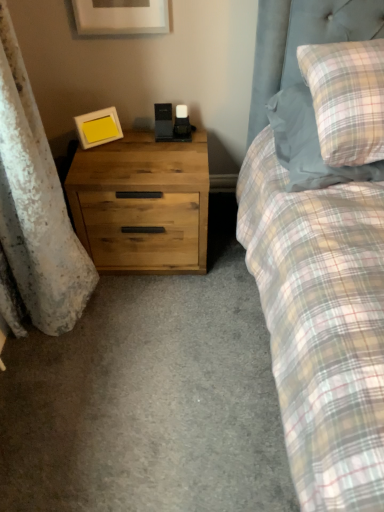
What is the approximate height of matte yellow picture frame at left, which is the 1th picture frame in bottom-to-top order?

It is 5.04 inches.

This screenshot has height=512, width=384. What do you see at coordinates (142, 202) in the screenshot?
I see `natural wood chest of drawers at left` at bounding box center [142, 202].

What do you see at coordinates (308, 144) in the screenshot? I see `plaid fabric pillow at upper right` at bounding box center [308, 144].

Find the location of `matte yellow picture frame at left, acting as the 2th picture frame starting from the front`. matte yellow picture frame at left, acting as the 2th picture frame starting from the front is located at coordinates pos(98,127).

From the image's perspective, which one is positioned higher, plaid fabric pillow at upper right or natural wood chest of drawers at left?

From the image's view, plaid fabric pillow at upper right is above.

Is point (306, 152) positioned after point (169, 204)?

No, it is not.

From a real-world perspective, which object rests below the other?

In real-world perspective, natural wood chest of drawers at left is lower.

Is natural wood chest of drawers at left at the back of plaid fabric pillow at upper right?

No, plaid fabric pillow at upper right's orientation is not away from natural wood chest of drawers at left.

Is matte yellow picture frame at left, the second picture frame viewed from the top, facing away from plaid fabric pillow at upper right?

No, matte yellow picture frame at left, the second picture frame viewed from the top, is not facing away from plaid fabric pillow at upper right.

Which point is more forward, (98, 133) or (295, 169)?

The point (295, 169) is more forward.

From the image's perspective, would you say matte yellow picture frame at left, which is the 1th picture frame in bottom-to-top order, is shown under plaid fabric pillow at upper right?

No, from the image's perspective, matte yellow picture frame at left, which is the 1th picture frame in bottom-to-top order, is not below plaid fabric pillow at upper right.

Locate an element on the screen. pillow above the matte yellow picture frame at left, the second picture frame viewed from the top (from a real-world perspective) is located at coordinates [x=308, y=144].

How different are the orientations of matte white picture frame at upper center, positioned as the second picture frame in back-to-front order, and natural wood chest of drawers at left in degrees?

They differ by 0.0361 degrees in their facing directions.

Would you consider matte white picture frame at upper center, positioned as the second picture frame in back-to-front order, to be distant from natural wood chest of drawers at left?

Actually, matte white picture frame at upper center, positioned as the second picture frame in back-to-front order, and natural wood chest of drawers at left are a little close together.

I want to click on chest of drawers below the matte white picture frame at upper center, the 2th picture frame positioned from the bottom (from the image's perspective), so click(x=142, y=202).

What's the angular difference between matte white picture frame at upper center, the 1th picture frame positioned from the top, and matte yellow picture frame at left, acting as the 2th picture frame starting from the front,'s facing directions?

The angular difference between matte white picture frame at upper center, the 1th picture frame positioned from the top, and matte yellow picture frame at left, acting as the 2th picture frame starting from the front, is 33.8 degrees.

From the image's perspective, relative to matte yellow picture frame at left, which is the 1th picture frame in bottom-to-top order, is matte white picture frame at upper center, the 1th picture frame positioned from the top, above or below?

Clearly, from the image's perspective, matte white picture frame at upper center, the 1th picture frame positioned from the top, is above matte yellow picture frame at left, which is the 1th picture frame in bottom-to-top order.

Is matte white picture frame at upper center, positioned as the second picture frame in back-to-front order, outside of matte yellow picture frame at left, which is the 1th picture frame in bottom-to-top order?

Yes, matte white picture frame at upper center, positioned as the second picture frame in back-to-front order, is not within matte yellow picture frame at left, which is the 1th picture frame in bottom-to-top order.

Which object is positioned more to the right, matte white picture frame at upper center, the first picture frame positioned from the front, or matte yellow picture frame at left, which is the 1th picture frame in bottom-to-top order?

matte white picture frame at upper center, the first picture frame positioned from the front, is more to the right.

Is natural wood chest of drawers at left in contact with matte yellow picture frame at left, which is the 1th picture frame in bottom-to-top order?

No, natural wood chest of drawers at left is not next to matte yellow picture frame at left, which is the 1th picture frame in bottom-to-top order.

Can you confirm if natural wood chest of drawers at left is taller than matte yellow picture frame at left, the second picture frame viewed from the top?

Indeed, natural wood chest of drawers at left has a greater height compared to matte yellow picture frame at left, the second picture frame viewed from the top.

Consider the image. Could you measure the distance between natural wood chest of drawers at left and matte yellow picture frame at left, acting as the 2th picture frame starting from the front?

natural wood chest of drawers at left is 11.22 inches from matte yellow picture frame at left, acting as the 2th picture frame starting from the front.

Which object is wider, natural wood chest of drawers at left or matte yellow picture frame at left, the second picture frame viewed from the top?

With larger width is natural wood chest of drawers at left.

Is matte white picture frame at upper center, the first picture frame positioned from the front, not close to plaid fabric pillow at upper right?

That's not correct — matte white picture frame at upper center, the first picture frame positioned from the front, is a little close to plaid fabric pillow at upper right.

From their relative heights in the image, would you say matte white picture frame at upper center, the 1th picture frame positioned from the top, is taller or shorter than plaid fabric pillow at upper right?

Clearly, matte white picture frame at upper center, the 1th picture frame positioned from the top, is taller compared to plaid fabric pillow at upper right.

Measure the distance between matte white picture frame at upper center, the 2th picture frame positioned from the bottom, and plaid fabric pillow at upper right.

26.52 inches.

From the image's perspective, is matte white picture frame at upper center, the first picture frame positioned from the front, on plaid fabric pillow at upper right?

Correct, matte white picture frame at upper center, the first picture frame positioned from the front, appears higher than plaid fabric pillow at upper right in the image.

From the image's perspective, is plaid fabric pillow at upper right positioned above or below matte yellow picture frame at left, the second picture frame viewed from the top?

plaid fabric pillow at upper right is below matte yellow picture frame at left, the second picture frame viewed from the top.

What are the coordinates of `pillow in front of the matte yellow picture frame at left, which appears as the 1th picture frame when viewed from the back` in the screenshot? It's located at (308, 144).

Considering the sizes of objects plaid fabric pillow at upper right and matte yellow picture frame at left, the second picture frame viewed from the top, in the image provided, who is smaller, plaid fabric pillow at upper right or matte yellow picture frame at left, the second picture frame viewed from the top,?

matte yellow picture frame at left, the second picture frame viewed from the top, is smaller.

Does plaid fabric pillow at upper right appear on the left side of matte yellow picture frame at left, which appears as the 1th picture frame when viewed from the back?

Incorrect, plaid fabric pillow at upper right is not on the left side of matte yellow picture frame at left, which appears as the 1th picture frame when viewed from the back.

This screenshot has height=512, width=384. I want to click on pillow above the natural wood chest of drawers at left (from a real-world perspective), so click(308, 144).

This screenshot has height=512, width=384. I want to click on picture frame that is under the plaid fabric pillow at upper right (from a real-world perspective), so (98, 127).

Which object lies further to the anchor point matte white picture frame at upper center, positioned as the second picture frame in back-to-front order, plaid fabric pillow at upper right or matte yellow picture frame at left, the second picture frame viewed from the top?

The object further to matte white picture frame at upper center, positioned as the second picture frame in back-to-front order, is plaid fabric pillow at upper right.

When comparing their distances from plaid fabric pillow at upper right, does matte yellow picture frame at left, which appears as the 1th picture frame when viewed from the back, or natural wood chest of drawers at left seem closer?

natural wood chest of drawers at left is closer to plaid fabric pillow at upper right.

Considering their positions, is natural wood chest of drawers at left positioned further to matte white picture frame at upper center, the 1th picture frame positioned from the top, than plaid fabric pillow at upper right?

plaid fabric pillow at upper right lies further to matte white picture frame at upper center, the 1th picture frame positioned from the top, than the other object.

Based on the photo, looking at the image, which one is located closer to matte white picture frame at upper center, the 2th picture frame positioned from the bottom, matte yellow picture frame at left, which is the 1th picture frame in bottom-to-top order, or natural wood chest of drawers at left?

matte yellow picture frame at left, which is the 1th picture frame in bottom-to-top order.

Looking at the image, which one is located closer to natural wood chest of drawers at left, matte yellow picture frame at left, which appears as the 1th picture frame when viewed from the back, or plaid fabric pillow at upper right?

The object closer to natural wood chest of drawers at left is matte yellow picture frame at left, which appears as the 1th picture frame when viewed from the back.

From the image, which object appears to be nearer to matte yellow picture frame at left, which is the 1th picture frame in bottom-to-top order, plaid fabric pillow at upper right or natural wood chest of drawers at left?

natural wood chest of drawers at left is positioned closer to the anchor matte yellow picture frame at left, which is the 1th picture frame in bottom-to-top order.

When comparing their distances from matte yellow picture frame at left, the second picture frame viewed from the top, does natural wood chest of drawers at left or plaid fabric pillow at upper right seem further?

plaid fabric pillow at upper right lies further to matte yellow picture frame at left, the second picture frame viewed from the top, than the other object.

Which object lies nearer to the anchor point natural wood chest of drawers at left, plaid fabric pillow at upper right or matte white picture frame at upper center, positioned as the second picture frame in back-to-front order?

plaid fabric pillow at upper right.

You are a GUI agent. You are given a task and a screenshot of the screen. Output one action in this format:
    pyautogui.click(x=<x>, y=<y>)
    Task: Click on the picture frame located between matte yellow picture frame at left, the second picture frame viewed from the top, and plaid fabric pillow at upper right in the left-right direction
    The height and width of the screenshot is (512, 384).
    Given the screenshot: What is the action you would take?
    pyautogui.click(x=120, y=17)

Locate an element on the screen. picture frame between matte white picture frame at upper center, the 1th picture frame positioned from the top, and natural wood chest of drawers at left from top to bottom is located at coordinates (98, 127).

Locate an element on the screen. The width and height of the screenshot is (384, 512). the chest of drawers situated between matte white picture frame at upper center, positioned as the second picture frame in back-to-front order, and plaid fabric pillow at upper right from left to right is located at coordinates (142, 202).

I want to click on chest of drawers between matte yellow picture frame at left, the second picture frame viewed from the top, and plaid fabric pillow at upper right, in the horizontal direction, so click(142, 202).